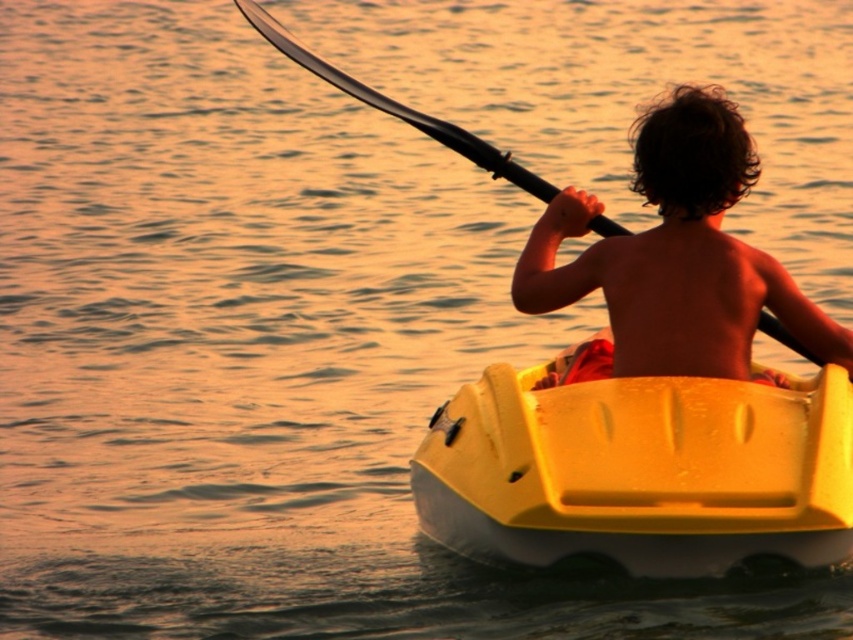
Is yellow plastic boat at center shorter than shiny brown hair at center?

Yes, yellow plastic boat at center is shorter than shiny brown hair at center.

The width and height of the screenshot is (853, 640). In order to click on yellow plastic boat at center in this screenshot , I will do `click(639, 470)`.